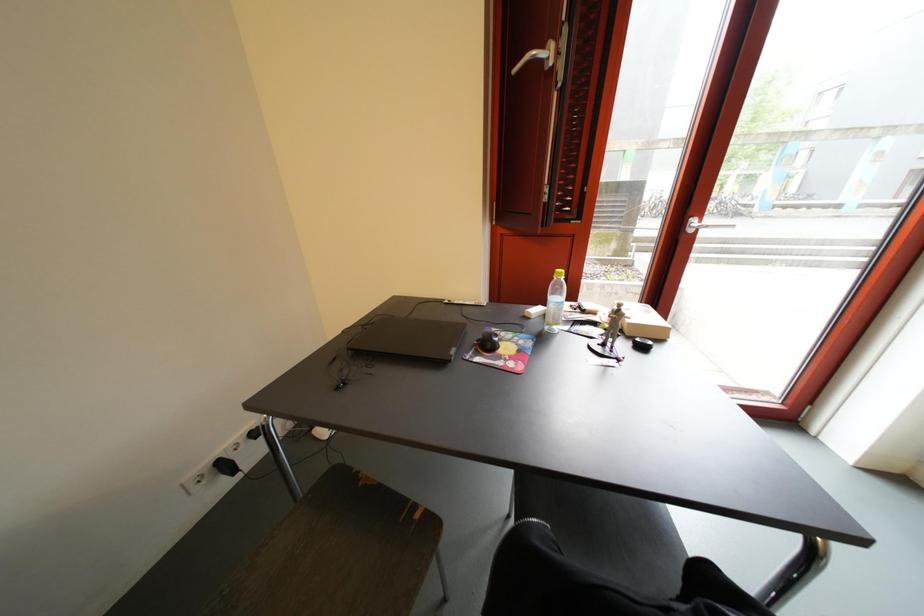
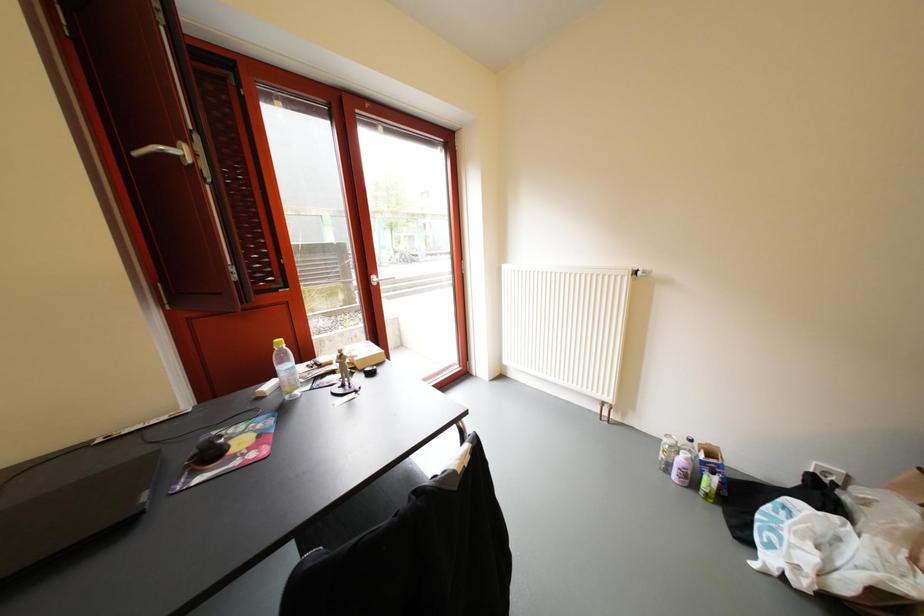
Question: The camera is either moving clockwise (left) or counter-clockwise (right) around the object. The first image is from the beginning of the video and the second image is from the end. Is the camera moving left or right when shooting the video?

Choices:
 (A) Left
 (B) Right

Answer: (A)